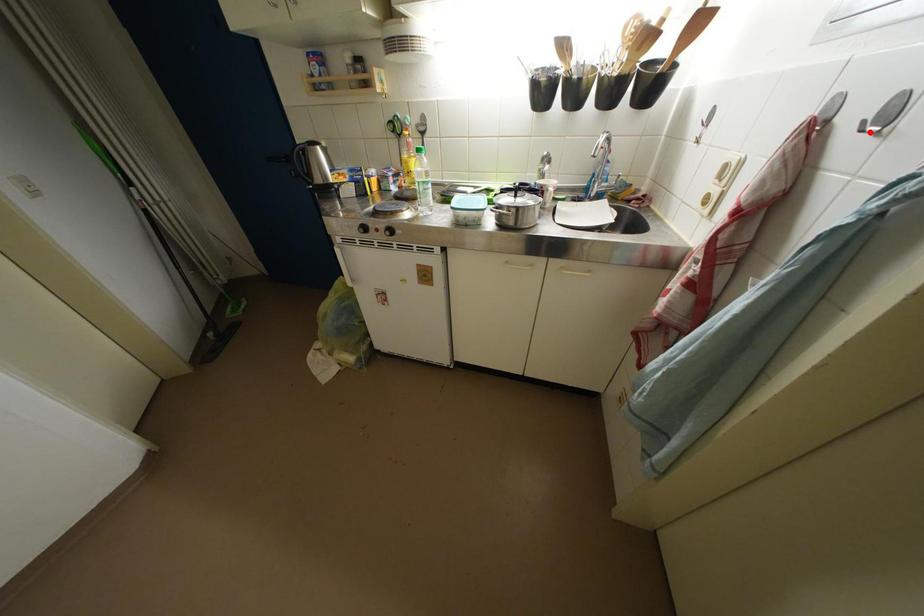
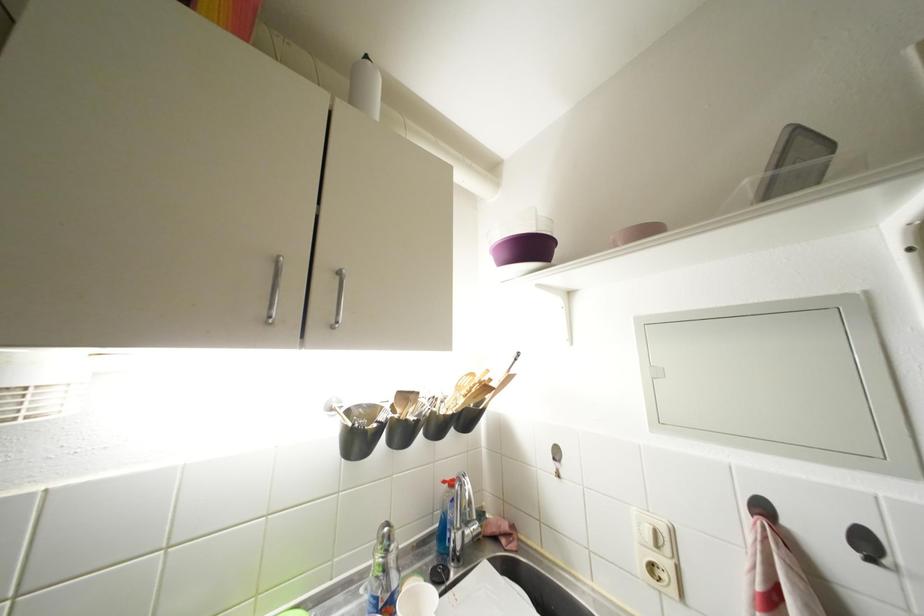
Question: A red point is marked in image1. In image2, is the corresponding 3D point closer to the camera or farther? Reply with the corresponding letter.

Choices:
 (A) The corresponding 3D point is closer.
 (B) The corresponding 3D point is farther.

Answer: (A)